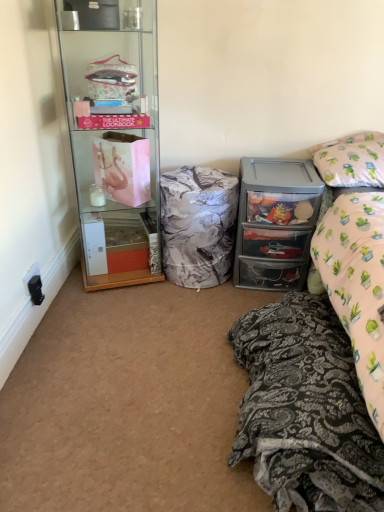
Question: Relative to clear plastic drawers at right, is black plastic power outlet at lower left in front or behind?

Choices:
 (A) behind
 (B) front

Answer: (B)

Question: From a real-world perspective, is black plastic power outlet at lower left above or below clear plastic drawers at right?

Choices:
 (A) above
 (B) below

Answer: (B)

Question: Estimate the real-world distances between objects in this image. Which object is farther from the patterned fabric bed at lower right?

Choices:
 (A) clear glass cabinet at left
 (B) pink fabric pillow at upper right
 (C) clear plastic drawers at right
 (D) black plastic power outlet at lower left
 (E) marble-patterned fabric at center

Answer: (D)

Question: Estimate the real-world distances between objects in this image. Which object is closer to the black plastic power outlet at lower left?

Choices:
 (A) clear plastic drawers at right
 (B) patterned fabric bed at lower right
 (C) pink fabric pillow at upper right
 (D) marble-patterned fabric at center
 (E) clear glass cabinet at left

Answer: (E)